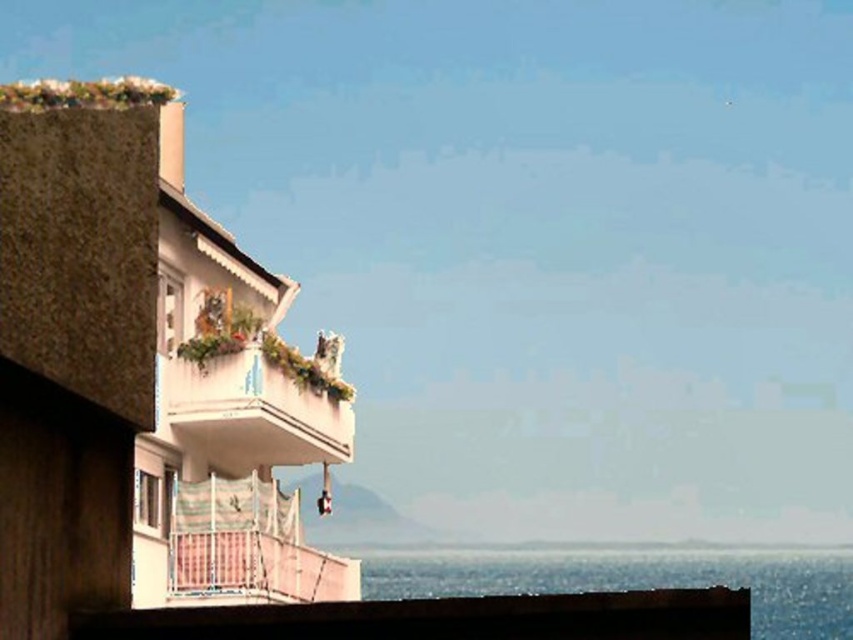
You are standing in front of the coastal building and notice two points marked on the balcony. The first point is at coordinates point [619,605] and the second is at point [602,563]. Which of these two points is nearer to your current position?

Point [619,605] is closer to the camera than point [602,563], so the first point is nearer to your current position.

You are a painter setting up your easel to capture the coastal scene. You want to ensure your painting accurately represents the sizes of the smooth concrete ledge at lower center and the blue water at lower right. Which object should you depict as the smaller one in your artwork?

The smooth concrete ledge at lower center is smaller than the blue water at lower right, so you should depict the smooth concrete ledge at lower center as the smaller one in your artwork.

You are standing on the white textured balcony at upper center and looking down. Can you see the blue water at lower right from your current position?

Yes, because the blue water at lower right is located below the white textured balcony at upper center, so you can see it from the balcony.